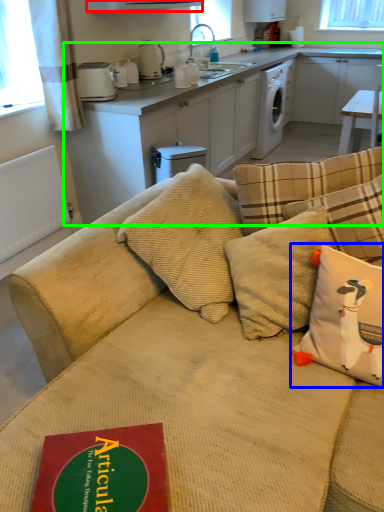
Question: Which object is the closest to the exhaust hood (highlighted by a red box)? Choose among these: pillow (highlighted by a blue box) or cabinetry (highlighted by a green box).

Choices:
 (A) pillow
 (B) cabinetry

Answer: (B)